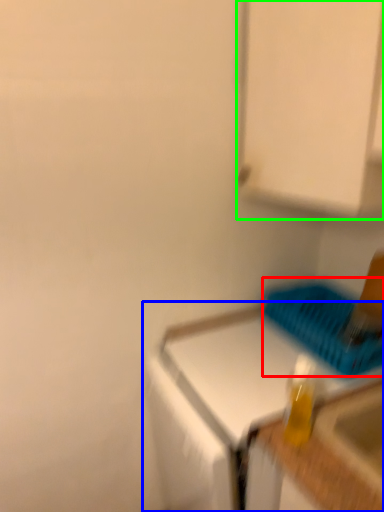
Question: Based on their relative distances, which object is farther from basket (highlighted by a red box)? Choose from countertop (highlighted by a blue box) and cabinetry (highlighted by a green box).

Choices:
 (A) countertop
 (B) cabinetry

Answer: (B)